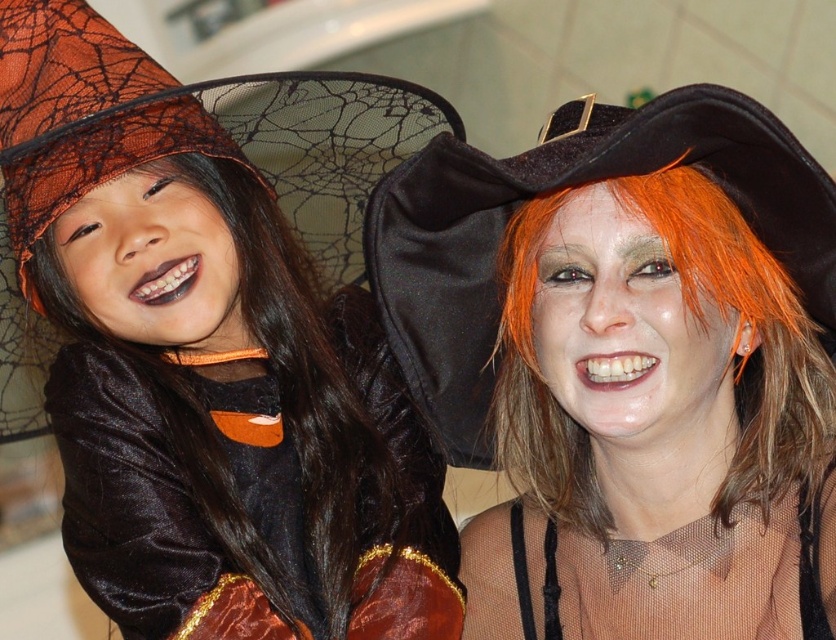
You are taking a photo of two witches in a Halloween costume. You notice two points marked in the image. One is at coordinates point (442, 621) and the other is at point (487, 189). Which point is closer to the camera?

Point (442, 621) is further to the camera than point (487, 189), so the point closer to the camera is point (487, 189).

You are standing in a Halloween party and see a point marked at coordinates point (348, 374). You want to place a decoration that requires a space of 5 feet from the viewer. Can you place it there?

The distance of point (348, 374) from viewer is 4.54 feet, so the decoration requires 5 feet of space which is longer than the available distance. Therefore, it cannot be placed there.